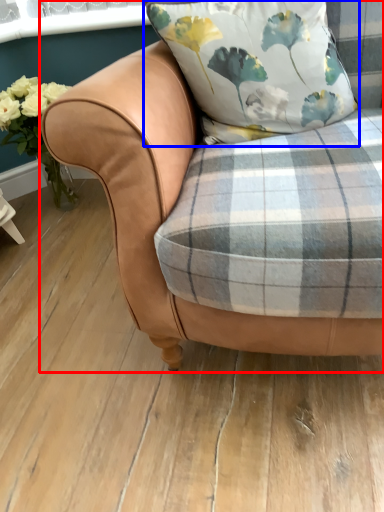
Question: Which object appears closest to the camera in this image, chair (highlighted by a red box) or pillow (highlighted by a blue box)?

Choices:
 (A) chair
 (B) pillow

Answer: (A)